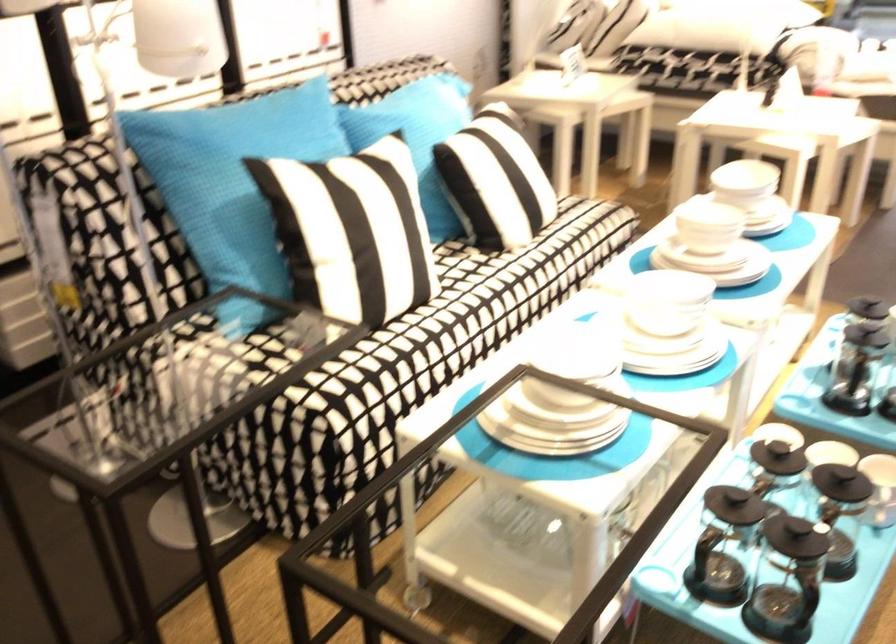
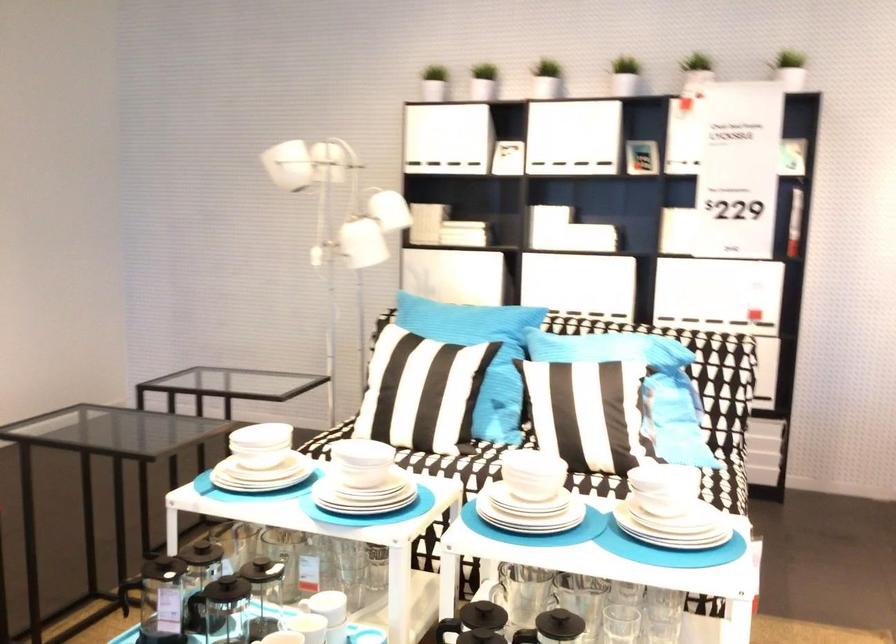
The point at (297,140) is marked in the first image. Where is the corresponding point in the second image?

(467, 324)